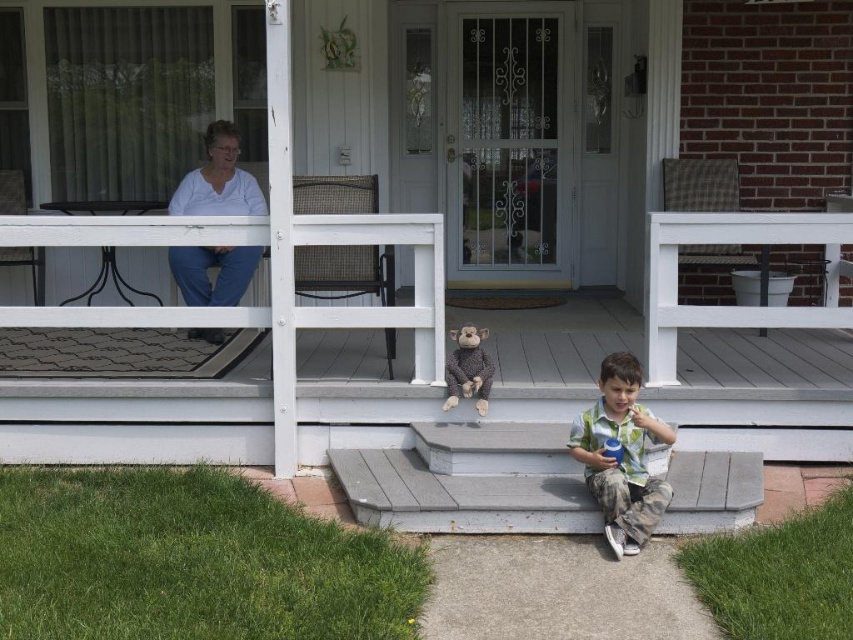
Does point (338, 470) lie behind point (194, 186)?

No, it is in front of (194, 186).

Locate an element on the screen. gray concrete stairs at lower center is located at coordinates (469, 481).

You are a GUI agent. You are given a task and a screenshot of the screen. Output one action in this format:
    pyautogui.click(x=<x>, y=<y>)
    Task: Click on the gray concrete stairs at lower center
    
    Given the screenshot: What is the action you would take?
    pyautogui.click(x=469, y=481)

Who is taller, white wooden porch at center or white cotton shirt at upper left?

With more height is white wooden porch at center.

Who is more forward, (218, 317) or (190, 176)?

Point (218, 317)

Is point (670, 268) more distant than point (198, 186)?

No, it is not.

Identify the location of white wooden porch at center. (241, 381).

Looking at this image, is white wooden porch at center to the right of gray concrete stairs at lower center from the viewer's perspective?

Incorrect, white wooden porch at center is not on the right side of gray concrete stairs at lower center.

Which is in front, point (648, 310) or point (486, 474)?

Point (486, 474)

Find the location of a particular element. The width and height of the screenshot is (853, 640). white wooden porch at center is located at coordinates (241, 381).